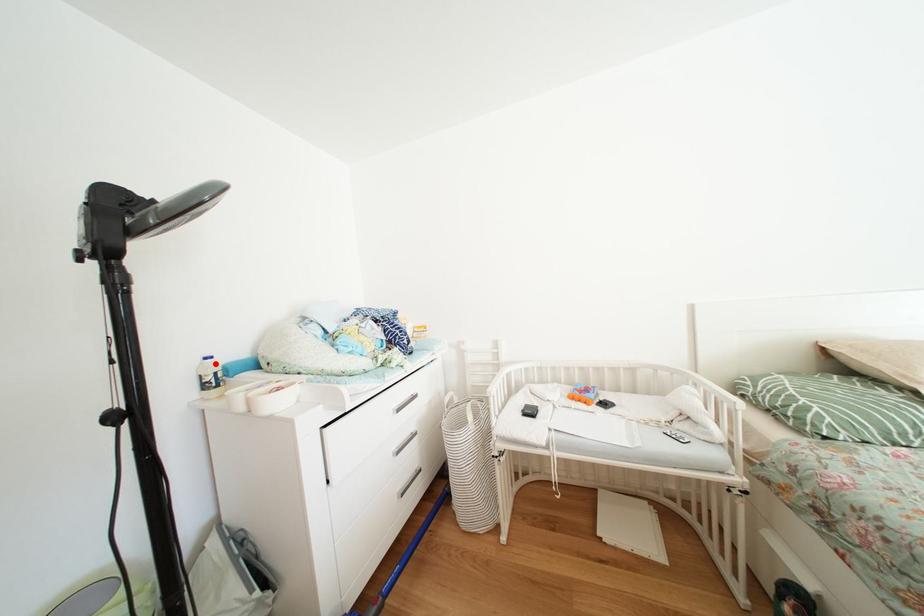
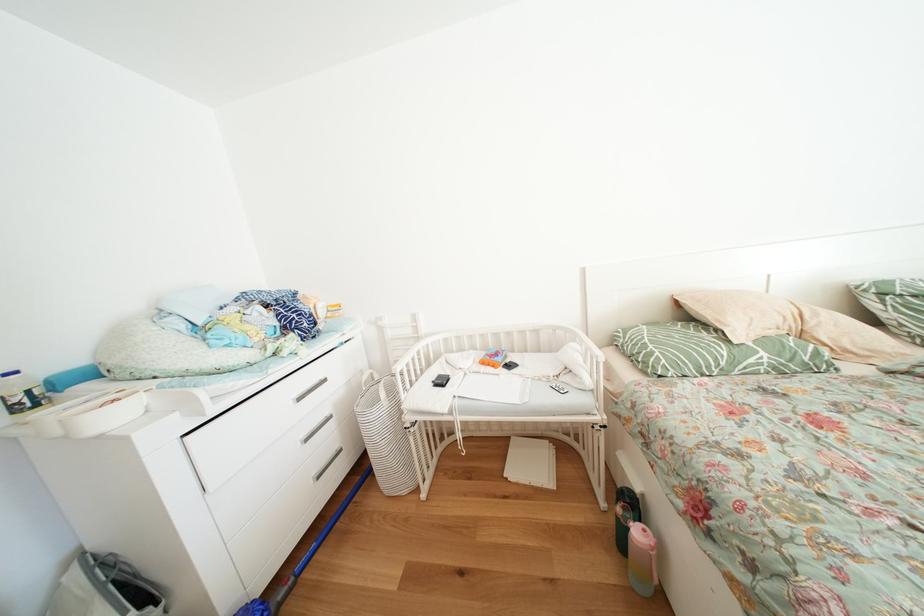
In the second image, find the point that corresponds to the highlighted location in the first image.

(16, 379)